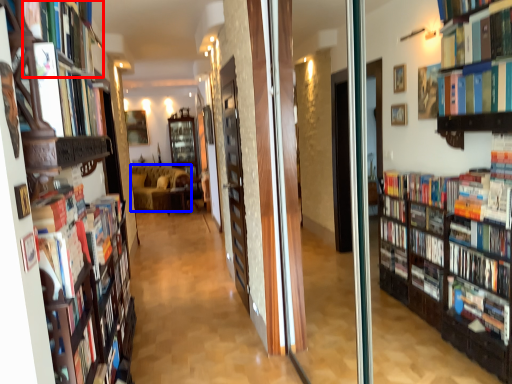
Question: Which of the following is the farthest to the observer, book (highlighted by a red box) or couch (highlighted by a blue box)?

Choices:
 (A) book
 (B) couch

Answer: (B)